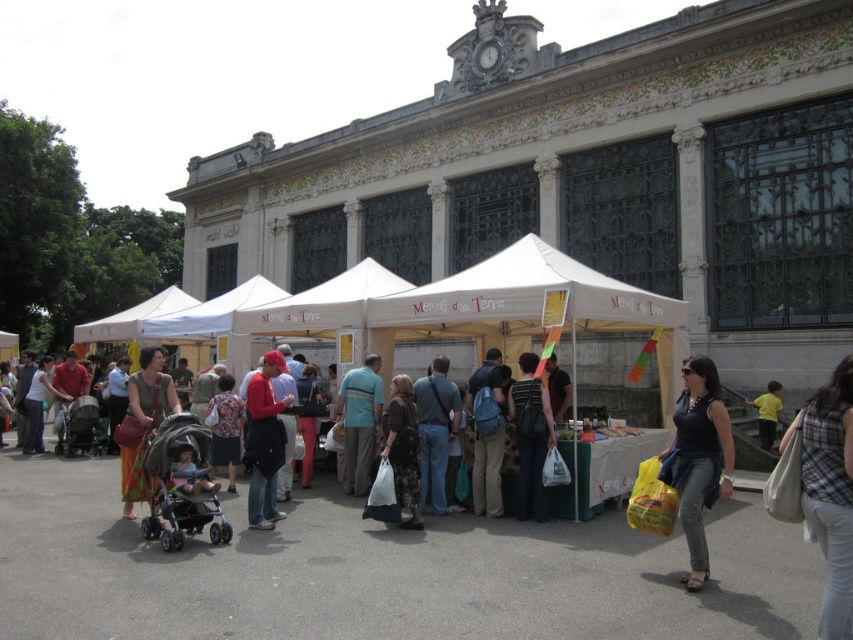
Between point (701, 394) and point (419, 378), which one is positioned behind?

The point (419, 378) is behind.

Identify the location of matte black tank top at center. (698, 458).

Identify the location of matte black tank top at center. (698, 458).

Can you confirm if silver metallic stroller at lower left is positioned to the left of matte brown purse at center?

No, silver metallic stroller at lower left is not to the left of matte brown purse at center.

Can you confirm if silver metallic stroller at lower left is bigger than matte brown purse at center?

No.

Locate an element on the screen. This screenshot has height=640, width=853. silver metallic stroller at lower left is located at coordinates (181, 484).

Is floral dress at center below yellow fabric at lower right?

Correct, floral dress at center is located below yellow fabric at lower right.

Which of these two, floral dress at center or yellow fabric at lower right, stands shorter?

yellow fabric at lower right

The image size is (853, 640). I want to click on floral dress at center, so click(225, 429).